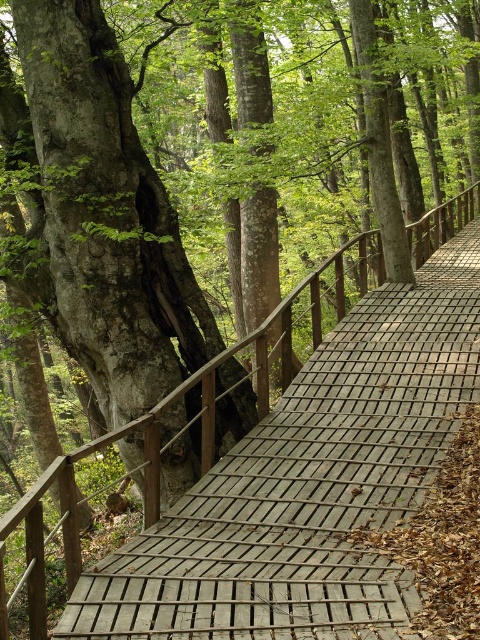
Question: Which object is closer to the camera taking this photo?

Choices:
 (A) wooden bridge at center
 (B) smooth gray bark at center

Answer: (A)

Question: Among these objects, which one is nearest to the camera?

Choices:
 (A) smooth gray bark at center
 (B) wooden bridge at center

Answer: (B)

Question: Is smooth gray bark at center above wooden bridge at center?

Choices:
 (A) yes
 (B) no

Answer: (B)

Question: Is smooth gray bark at center bigger than wooden bridge at center?

Choices:
 (A) no
 (B) yes

Answer: (A)

Question: Does smooth gray bark at center appear over wooden bridge at center?

Choices:
 (A) no
 (B) yes

Answer: (A)

Question: Which point is closer to the camera taking this photo?

Choices:
 (A) (72, 179)
 (B) (66, 509)

Answer: (B)